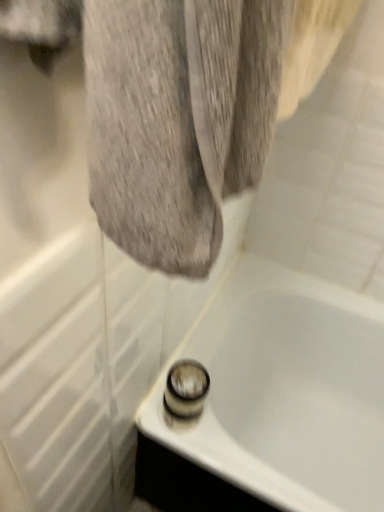
Question: Could shiny chrome shower at bottom center be considered to be inside white glossy bathtub at lower center?

Choices:
 (A) no
 (B) yes

Answer: (A)

Question: From a real-world perspective, is white glossy bathtub at lower center physically above shiny chrome shower at bottom center?

Choices:
 (A) no
 (B) yes

Answer: (A)

Question: Does white glossy bathtub at lower center turn towards shiny chrome shower at bottom center?

Choices:
 (A) no
 (B) yes

Answer: (A)

Question: From the image's perspective, is white glossy bathtub at lower center on shiny chrome shower at bottom center?

Choices:
 (A) no
 (B) yes

Answer: (A)

Question: Does white glossy bathtub at lower center appear on the left side of shiny chrome shower at bottom center?

Choices:
 (A) no
 (B) yes

Answer: (A)

Question: Is white glossy bathtub at lower center taller than shiny chrome shower at bottom center?

Choices:
 (A) yes
 (B) no

Answer: (A)

Question: From the image's perspective, does shiny chrome shower at bottom center appear lower than white glossy bathtub at lower center?

Choices:
 (A) no
 (B) yes

Answer: (A)

Question: Is shiny chrome shower at bottom center not near white glossy bathtub at lower center?

Choices:
 (A) no
 (B) yes

Answer: (A)

Question: Is shiny chrome shower at bottom center to the right of white glossy bathtub at lower center from the viewer's perspective?

Choices:
 (A) yes
 (B) no

Answer: (B)

Question: Is shiny chrome shower at bottom center completely or partially outside of white glossy bathtub at lower center?

Choices:
 (A) no
 (B) yes

Answer: (B)

Question: Is shiny chrome shower at bottom center at the left side of white glossy bathtub at lower center?

Choices:
 (A) no
 (B) yes

Answer: (B)

Question: Is shiny chrome shower at bottom center looking in the opposite direction of white glossy bathtub at lower center?

Choices:
 (A) no
 (B) yes

Answer: (A)

Question: Relative to shiny chrome shower at bottom center, is white glossy bathtub at lower center in front or behind?

Choices:
 (A) front
 (B) behind

Answer: (A)